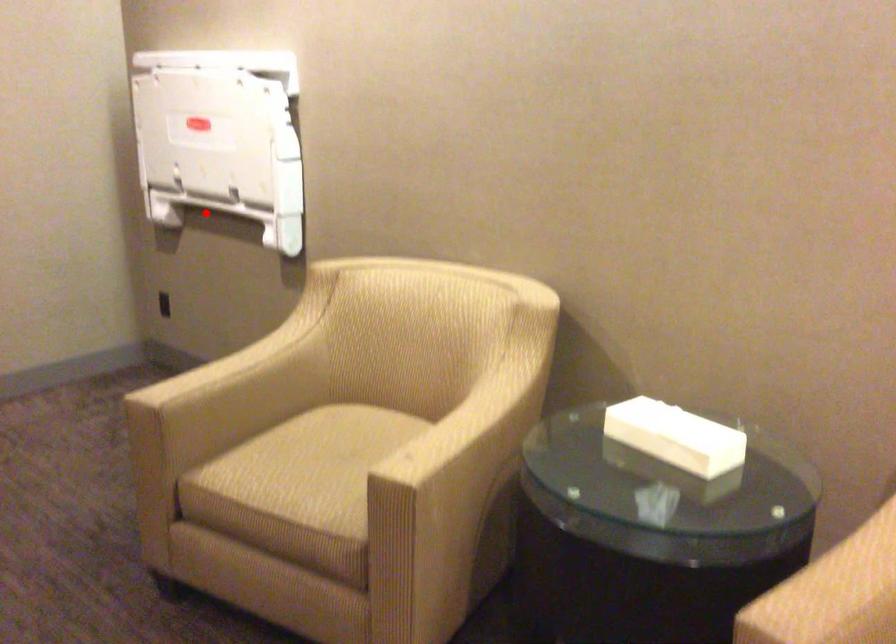
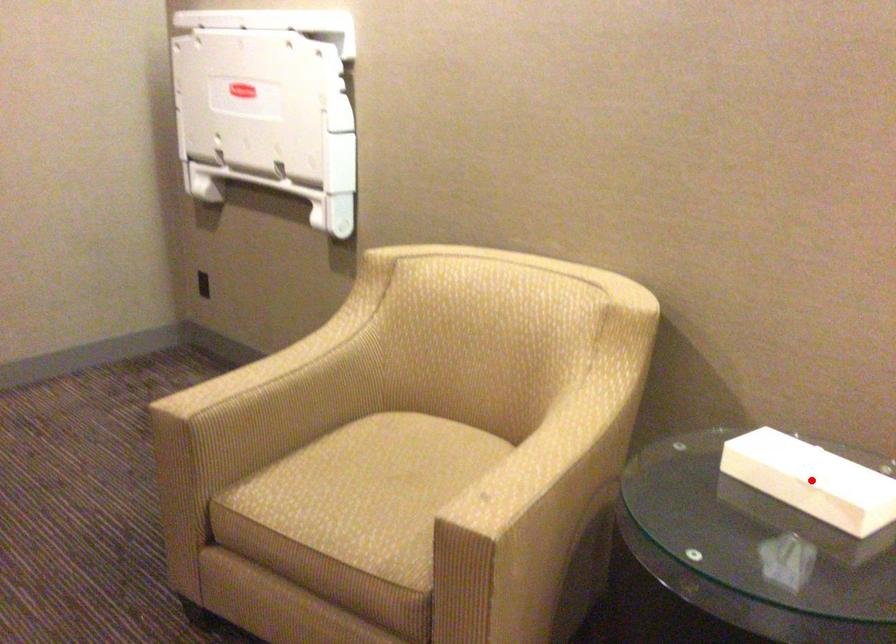
I am providing you with two images of the same scene from different viewpoints. A red point is marked on the first image and another point is marked on the second image. Is the marked point in image1 the same physical position as the marked point in image2?

No